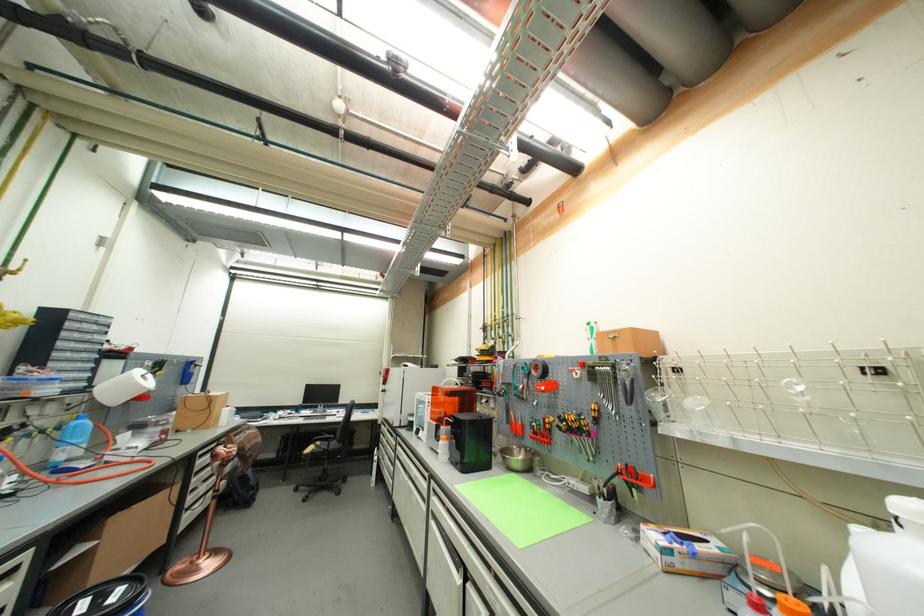
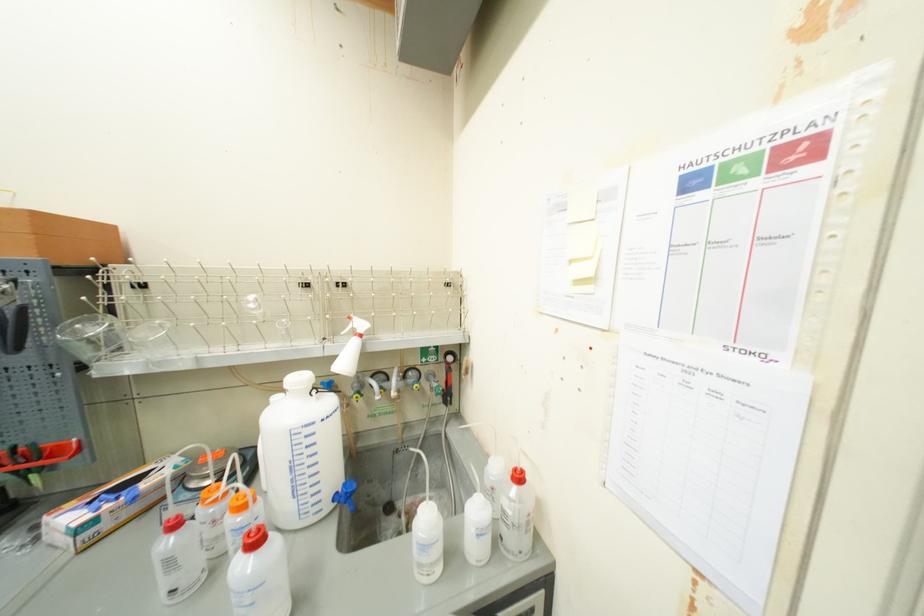
Question: I am providing you with two images of the same scene from different viewpoints. Given a red point in image1, look at the same physical point in image2. Is it:

Choices:
 (A) Closer to the viewpoint
 (B) Farther from the viewpoint

Answer: (A)